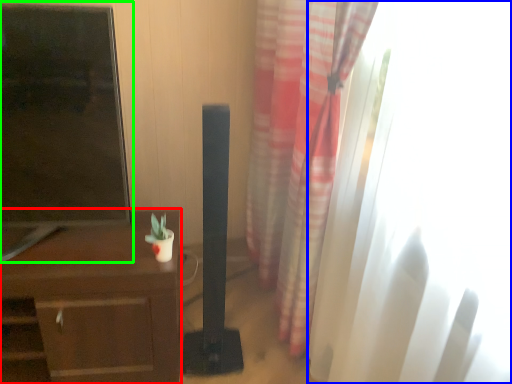
Question: Based on their relative distances, which object is farther from desk (highlighted by a red box)? Choose from window (highlighted by a blue box) and tv show (highlighted by a green box).

Choices:
 (A) window
 (B) tv show

Answer: (A)